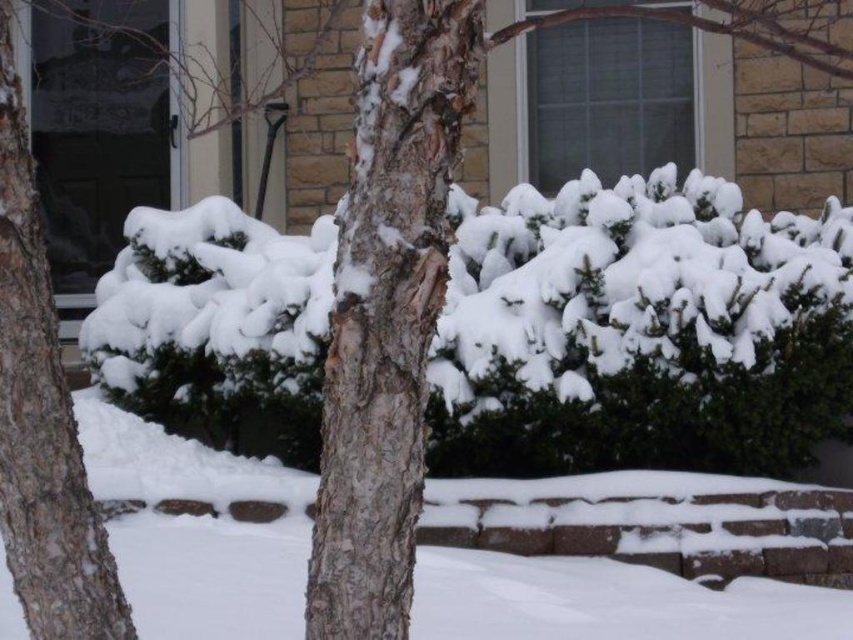
You are standing in the winter scene and want to touch the tree trunk. Which object in the scene is located at the coordinates point (387, 310)?

The point (387, 310) is on the bark textured tree trunk at center.

You are standing in front of the house looking at the winter scene. There are two points marked in the image. The first point is at coordinates point (254, 237) and the second point is at point (334, 557). Which point is closer to you?

Point (254, 237) is further to the camera than point (334, 557), so the point closer to you is point (334, 557).

You are standing in the snow in front of the house and want to walk from the bark textured tree trunk at center to the white fluffy hedge at center. Which direction should you face to walk directly towards the hedge?

You should face to the right to walk directly towards the white fluffy hedge at center, since it is located to the right of the bark textured tree trunk at center.